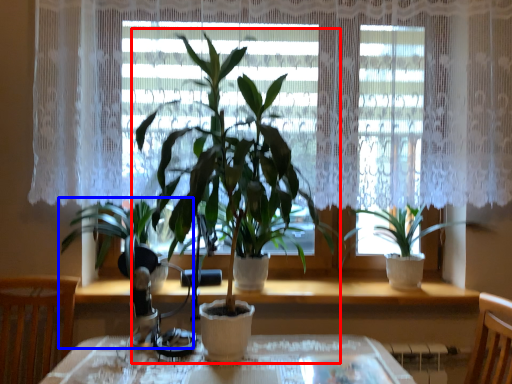
Question: Which of the following is the farthest to the observer, houseplant (highlighted by a red box) or houseplant (highlighted by a blue box)?

Choices:
 (A) houseplant
 (B) houseplant

Answer: (B)